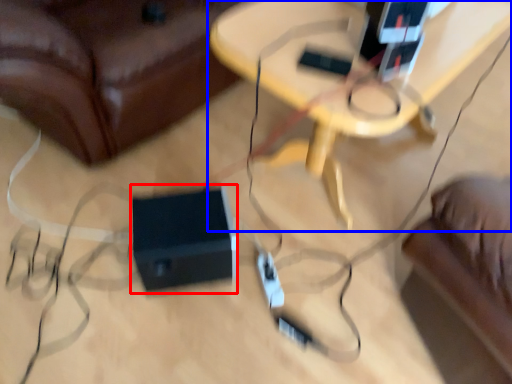
Question: Which point is further to the camera, speaker (highlighted by a red box) or table (highlighted by a blue box)?

Choices:
 (A) speaker
 (B) table

Answer: (A)